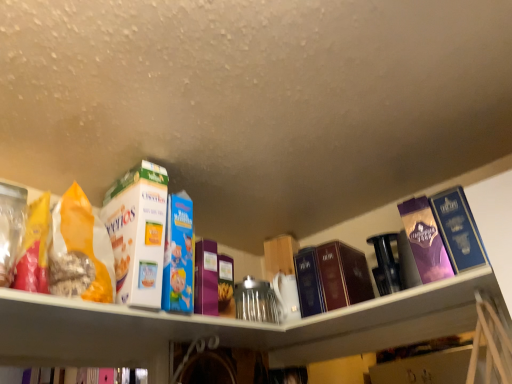
Question: From the image's perspective, is hardcover book at center, placed as the fourth book when sorted from right to left, on top of purple glossy book at upper right, the 8th book from the left?

Choices:
 (A) yes
 (B) no

Answer: (B)

Question: From a real-world perspective, is hardcover book at center, placed as the fourth book when sorted from right to left, below purple glossy book at upper right, the 8th book from the left?

Choices:
 (A) yes
 (B) no

Answer: (A)

Question: From a real-world perspective, is hardcover book at center, placed as the fourth book when sorted from right to left, located higher than purple glossy book at upper right, marked as the 1th book in a right-to-left arrangement?

Choices:
 (A) yes
 (B) no

Answer: (B)

Question: Is hardcover book at center, which is counted as the 5th book, starting from the left, smaller than purple glossy book at upper right, marked as the 1th book in a right-to-left arrangement?

Choices:
 (A) no
 (B) yes

Answer: (B)

Question: Is the surface of hardcover book at center, placed as the fourth book when sorted from right to left, in direct contact with purple glossy book at upper right, the 8th book from the left?

Choices:
 (A) no
 (B) yes

Answer: (A)

Question: Is point (344, 291) positioned closer to the camera than point (83, 208)?

Choices:
 (A) closer
 (B) farther

Answer: (B)

Question: Visually, is dark blue hardcover book at center, arranged as the sixth book when viewed from the left, positioned to the left or to the right of matte orange bag of cereal at left?

Choices:
 (A) left
 (B) right

Answer: (B)

Question: From a real-world perspective, relative to matte orange bag of cereal at left, is dark blue hardcover book at center, the third book when ordered from right to left, vertically above or below?

Choices:
 (A) above
 (B) below

Answer: (B)

Question: Is dark blue hardcover book at center, arranged as the sixth book when viewed from the left, wider or thinner than matte orange bag of cereal at left?

Choices:
 (A) thin
 (B) wide

Answer: (B)

Question: From a real-world perspective, relative to clear plastic jar at left, the 1th book from the left, is white cardboard cereal box at upper left, the second book when ordered from left to right, vertically above or below?

Choices:
 (A) below
 (B) above

Answer: (B)

Question: Is white cardboard cereal box at upper left, which is the 7th book in right-to-left order, bigger or smaller than clear plastic jar at left, which appears as the 8th book when viewed from the right?

Choices:
 (A) big
 (B) small

Answer: (A)

Question: Is white cardboard cereal box at upper left, which is the 7th book in right-to-left order, inside the boundaries of clear plastic jar at left, the 1th book from the left, or outside?

Choices:
 (A) inside
 (B) outside

Answer: (B)

Question: Is white cardboard cereal box at upper left, which is the 7th book in right-to-left order, in front of or behind clear plastic jar at left, the 1th book from the left, in the image?

Choices:
 (A) front
 (B) behind

Answer: (B)

Question: From the image's perspective, relative to white cardboard cereal box at upper left, the second book when ordered from left to right, is matte orange bag of cereal at left above or below?

Choices:
 (A) above
 (B) below

Answer: (A)

Question: Which is correct: matte orange bag of cereal at left is inside white cardboard cereal box at upper left, which is the 7th book in right-to-left order, or outside of it?

Choices:
 (A) outside
 (B) inside

Answer: (A)